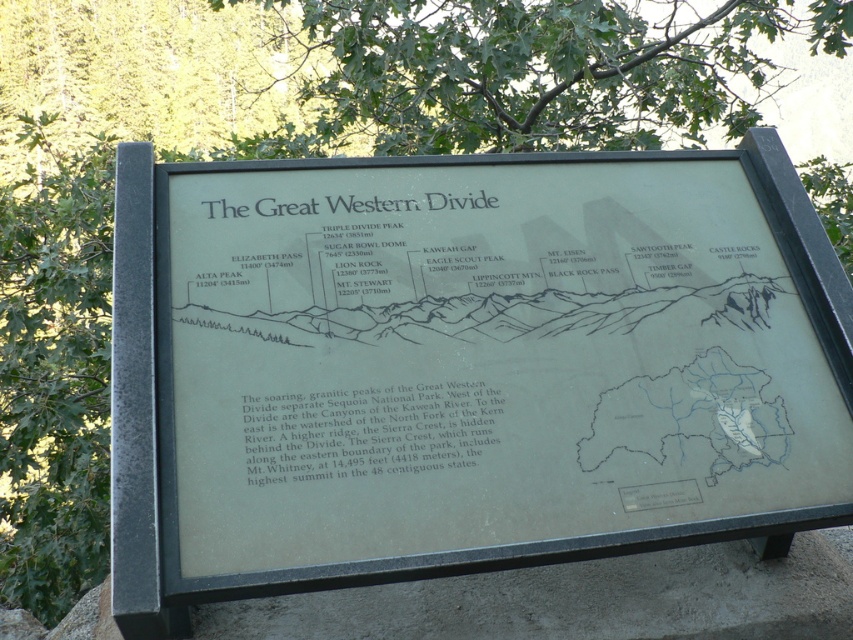
Question: Is metallic plaque at center to the right of black paper text at center from the viewer's perspective?

Choices:
 (A) yes
 (B) no

Answer: (A)

Question: Among these points, which one is nearest to the camera?

Choices:
 (A) pyautogui.click(x=477, y=448)
 (B) pyautogui.click(x=660, y=496)
 (C) pyautogui.click(x=486, y=376)

Answer: (B)

Question: Estimate the real-world distances between objects in this image. Which object is farther from the transparent paper map at center?

Choices:
 (A) metallic plaque at center
 (B) black paper text at center

Answer: (B)

Question: Which point is closer to the camera taking this photo?

Choices:
 (A) (206, 392)
 (B) (432, 417)

Answer: (A)

Question: Does black paper text at center have a smaller size compared to white plastic sign at lower right?

Choices:
 (A) no
 (B) yes

Answer: (A)

Question: Is metallic plaque at center above transparent paper map at center?

Choices:
 (A) no
 (B) yes

Answer: (B)